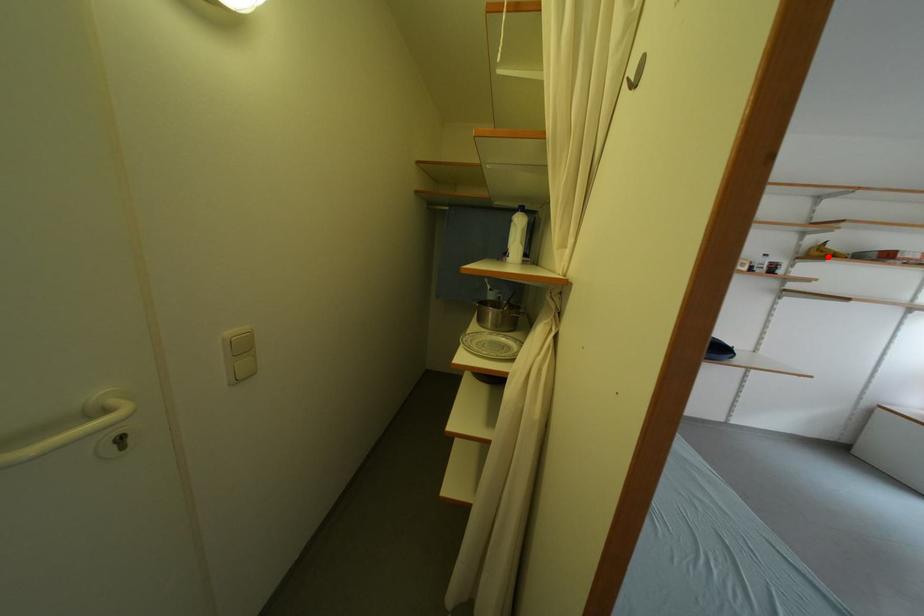
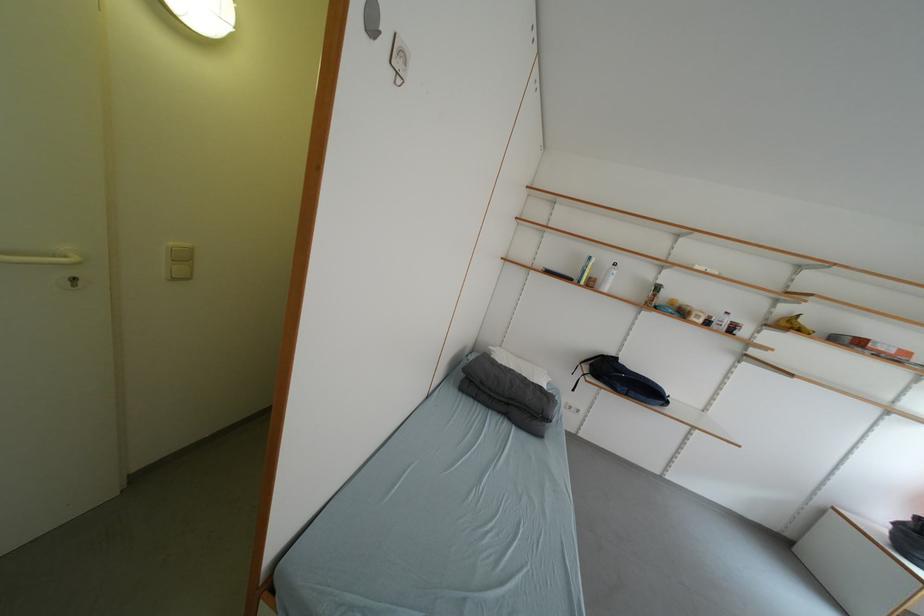
In the second image, find the point that corresponds to the highlighted location in the first image.

(797, 328)